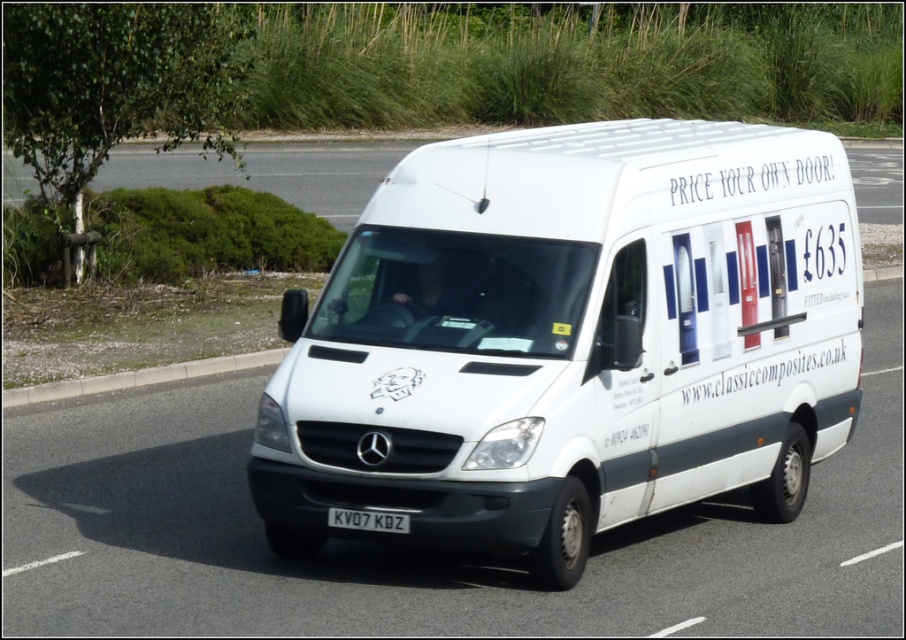
Question: Which of the following is the farthest from the observer?

Choices:
 (A) black metallic license plate at center
 (B) concrete at lower left
 (C) white matte van at center

Answer: (B)

Question: Among these objects, which one is nearest to the camera?

Choices:
 (A) white matte van at center
 (B) black metallic license plate at center
 (C) concrete at lower left

Answer: (A)

Question: Among these objects, which one is farthest from the camera?

Choices:
 (A) white matte van at center
 (B) concrete at lower left
 (C) black metallic license plate at center

Answer: (B)

Question: In this image, where is concrete at lower left located relative to black metallic license plate at center?

Choices:
 (A) right
 (B) left

Answer: (B)

Question: Observing the image, what is the correct spatial positioning of white matte van at center in reference to black metallic license plate at center?

Choices:
 (A) left
 (B) right

Answer: (B)

Question: Is white matte van at center smaller than black metallic license plate at center?

Choices:
 (A) yes
 (B) no

Answer: (B)